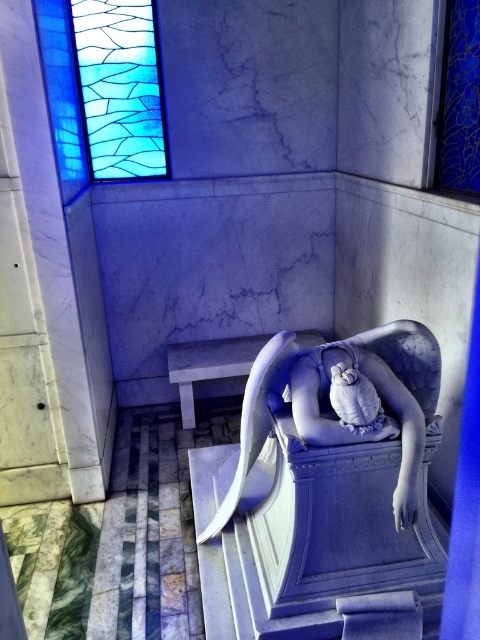
Locate an element on the screen. satin blue statue at center is located at coordinates (372, 396).

Is satin blue statue at center smaller than stained glass window at upper left?

Indeed, satin blue statue at center has a smaller size compared to stained glass window at upper left.

Is point (311, 444) positioned behind point (113, 81)?

No.

Identify the location of satin blue statue at center. Image resolution: width=480 pixels, height=640 pixels. (372, 396).

Between white marble statue at center and stained glass window at upper left, which one appears on the left side from the viewer's perspective?

From the viewer's perspective, stained glass window at upper left appears more on the left side.

Is white marble statue at center smaller than stained glass window at upper left?

Incorrect, white marble statue at center is not smaller in size than stained glass window at upper left.

The width and height of the screenshot is (480, 640). Describe the element at coordinates (323, 492) in the screenshot. I see `white marble statue at center` at that location.

Where is `white marble statue at center`? Image resolution: width=480 pixels, height=640 pixels. white marble statue at center is located at coordinates (323, 492).

Can you confirm if white marble statue at center is positioned above satin blue statue at center?

No.

Can you confirm if white marble statue at center is positioned below satin blue statue at center?

Yes.

Locate an element on the screen. This screenshot has width=480, height=640. white marble statue at center is located at coordinates (323, 492).